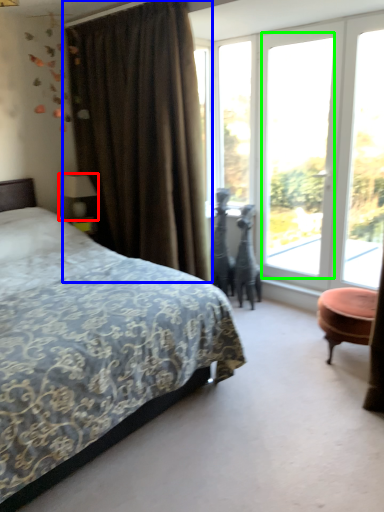
Question: Which object is positioned closest to table lamp (highlighted by a red box)? Select from curtain (highlighted by a blue box) and window (highlighted by a green box).

Choices:
 (A) curtain
 (B) window

Answer: (A)